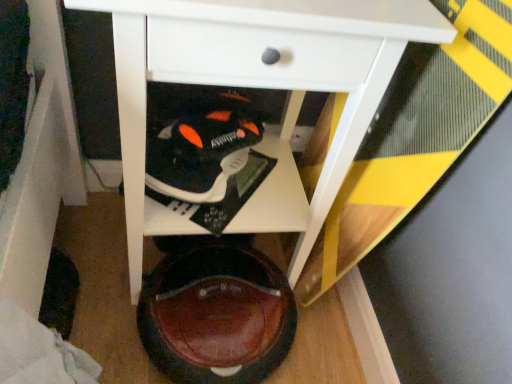
Question: From a real-world perspective, is black matte sneaker at center, arranged as the 2th footwear when ordered from the bottom, beneath white glossy table at center?

Choices:
 (A) no
 (B) yes

Answer: (B)

Question: Is black matte sneaker at center, positioned as the 1th footwear in top-to-bottom order, thinner than white glossy table at center?

Choices:
 (A) no
 (B) yes

Answer: (B)

Question: Is black matte sneaker at center, positioned as the 1th footwear in top-to-bottom order, bigger than white glossy table at center?

Choices:
 (A) yes
 (B) no

Answer: (B)

Question: From the image's perspective, is black matte sneaker at center, arranged as the 2th footwear when ordered from the bottom, over white glossy table at center?

Choices:
 (A) no
 (B) yes

Answer: (A)

Question: Is white glossy table at center at the back of black matte sneaker at center, positioned as the 1th footwear in top-to-bottom order?

Choices:
 (A) no
 (B) yes

Answer: (B)

Question: Considering the positions of white glossy table at center and black matte sneaker at center, positioned as the 1th footwear in top-to-bottom order, in the image, is white glossy table at center wider or thinner than black matte sneaker at center, positioned as the 1th footwear in top-to-bottom order,?

Choices:
 (A) thin
 (B) wide

Answer: (B)

Question: From the image's perspective, is white glossy table at center located above or below black matte sneaker at center, arranged as the 2th footwear when ordered from the bottom?

Choices:
 (A) above
 (B) below

Answer: (A)

Question: Is point (137, 173) positioned closer to the camera than point (153, 142)?

Choices:
 (A) farther
 (B) closer

Answer: (B)

Question: Which is correct: white glossy table at center is inside black matte sneaker at center, positioned as the 1th footwear in top-to-bottom order, or outside of it?

Choices:
 (A) inside
 (B) outside

Answer: (B)

Question: In terms of width, does white glossy table at center look wider or thinner when compared to brown leather shoe at lower center, which is counted as the second footwear, starting from the top?

Choices:
 (A) wide
 (B) thin

Answer: (A)

Question: Choose the correct answer: Is white glossy table at center inside brown leather shoe at lower center, which is counted as the second footwear, starting from the top, or outside it?

Choices:
 (A) inside
 (B) outside

Answer: (B)

Question: Based on their sizes in the image, would you say white glossy table at center is bigger or smaller than brown leather shoe at lower center, arranged as the 1th footwear when ordered from the bottom?

Choices:
 (A) small
 (B) big

Answer: (B)

Question: From the image's perspective, is white glossy table at center located above or below brown leather shoe at lower center, which is counted as the second footwear, starting from the top?

Choices:
 (A) below
 (B) above

Answer: (B)

Question: Is point [x=154, y=147] closer or farther from the camera than point [x=192, y=334]?

Choices:
 (A) closer
 (B) farther

Answer: (A)

Question: From a real-world perspective, relative to brown leather shoe at lower center, which is counted as the second footwear, starting from the top, is black matte sneaker at center, positioned as the 1th footwear in top-to-bottom order, vertically above or below?

Choices:
 (A) below
 (B) above

Answer: (B)